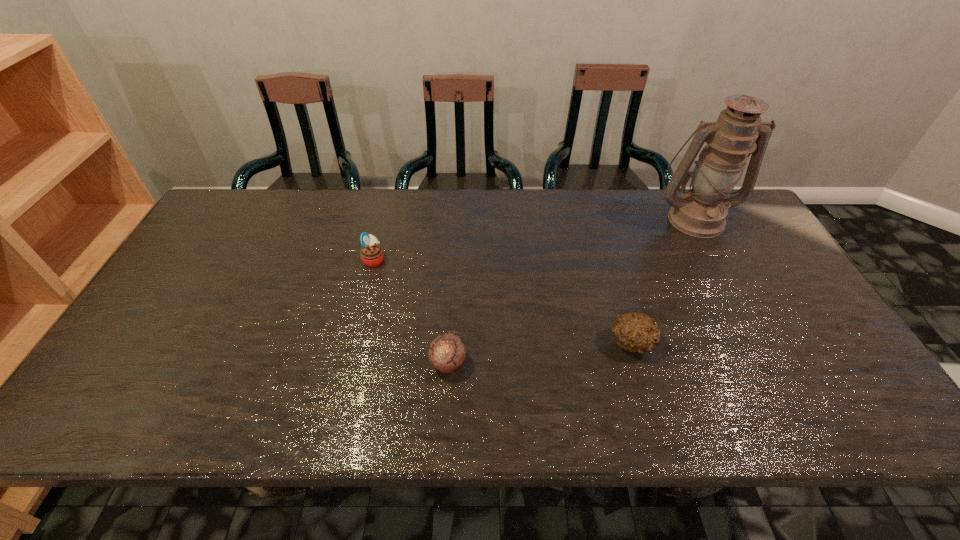
In order to click on the farthest object in this screenshot , I will do `click(701, 212)`.

The image size is (960, 540). Identify the location of the rightmost object. (701, 212).

This screenshot has width=960, height=540. Find the location of `the leftmost object`. the leftmost object is located at coordinates (372, 255).

Locate an element on the screen. This screenshot has width=960, height=540. the third shortest object is located at coordinates (372, 255).

This screenshot has width=960, height=540. What are the coordinates of `the third object from right to left` in the screenshot? It's located at (447, 352).

Where is `the third object from left to right`? The height and width of the screenshot is (540, 960). the third object from left to right is located at coordinates (635, 332).

The height and width of the screenshot is (540, 960). In order to click on blank space located on the back of the rightmost object in this screenshot , I will do `click(679, 188)`.

The width and height of the screenshot is (960, 540). I want to click on blank area located 0.360m on the front-facing side of the third shortest object, so click(509, 259).

The width and height of the screenshot is (960, 540). What are the coordinates of `free space located 0.230m on the left of the third object from right to left` in the screenshot? It's located at (332, 363).

The height and width of the screenshot is (540, 960). What are the coordinates of `free space located 0.070m on the left of the third object from left to right` in the screenshot? It's located at (579, 343).